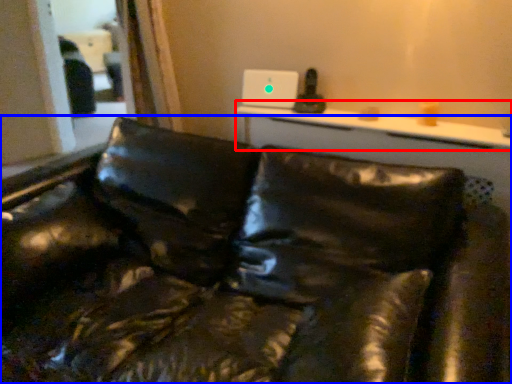
Question: Which of the following is the closest to the observer, table (highlighted by a red box) or studio couch (highlighted by a blue box)?

Choices:
 (A) table
 (B) studio couch

Answer: (B)